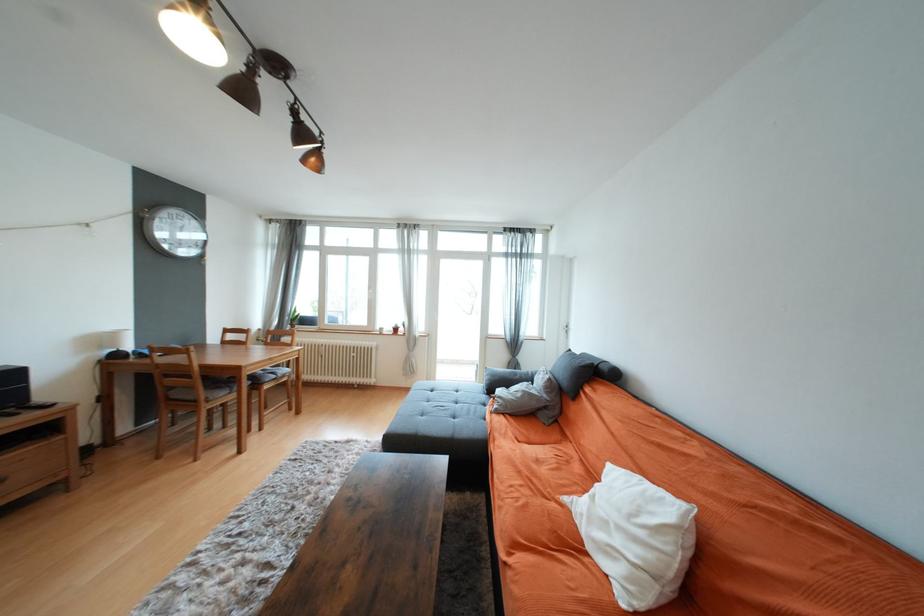
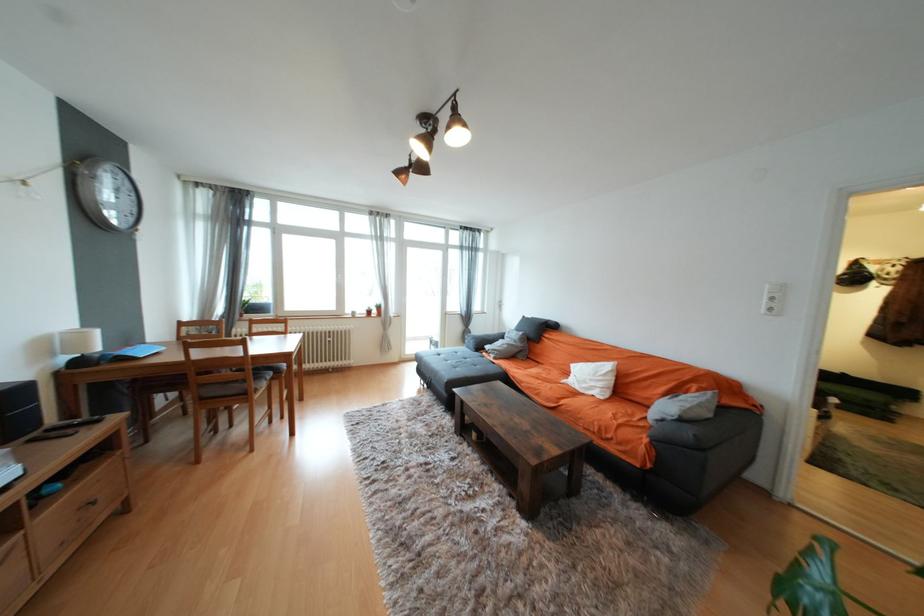
Question: In a continuous first-person perspective shot, in which direction is the camera moving?

Choices:
 (A) Left
 (B) Right
 (C) Forward
 (D) Backward

Answer: (A)